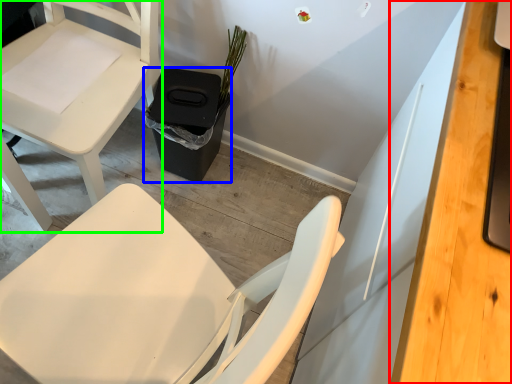
Question: Which is nearer to the desk (highlighted by a red box)? trash bin/can (highlighted by a blue box) or chair (highlighted by a green box).

Choices:
 (A) trash bin/can
 (B) chair

Answer: (A)